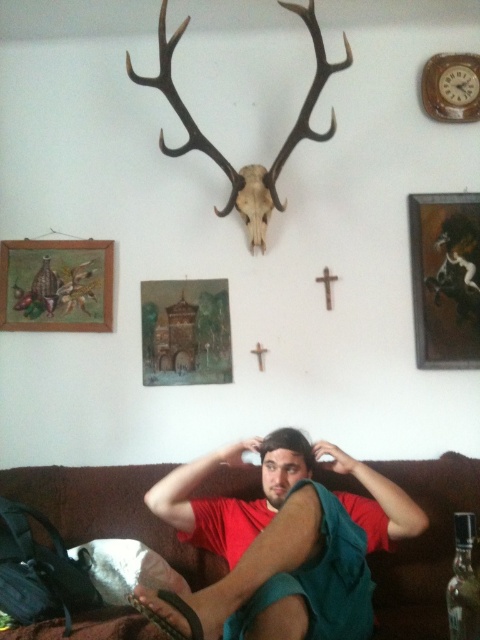
Is red matte shirt at center wider than wooden framed artwork at left?

Yes.

Does red matte shirt at center have a larger size compared to wooden framed artwork at left?

Correct, red matte shirt at center is larger in size than wooden framed artwork at left.

Who is more distant from viewer, (x=304, y=460) or (x=54, y=326)?

The point (x=54, y=326) is more distant.

I want to click on red matte shirt at center, so click(276, 516).

Does wooden framed artwork at left have a greater width compared to transparent plastic bottle at lower right?

Correct, the width of wooden framed artwork at left exceeds that of transparent plastic bottle at lower right.

Who is more distant from viewer, (67, 266) or (464, 614)?

Positioned behind is point (67, 266).

This screenshot has width=480, height=640. I want to click on wooden framed artwork at left, so click(56, 285).

Who is taller, red matte shirt at center or brown matte antler at upper center?

With more height is brown matte antler at upper center.

Describe the element at coordinates (276, 516) in the screenshot. This screenshot has height=640, width=480. I see `red matte shirt at center` at that location.

Where is `red matte shirt at center`? Image resolution: width=480 pixels, height=640 pixels. red matte shirt at center is located at coordinates (276, 516).